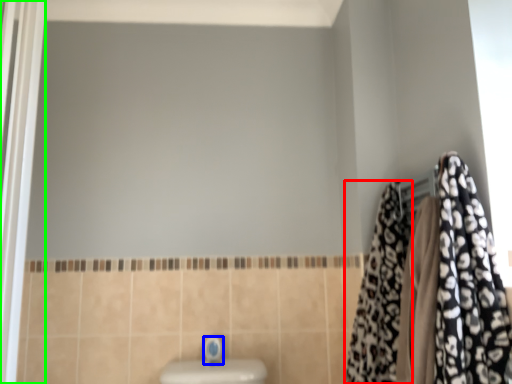
Question: Based on their relative distances, which object is farther from cloth (highlighted by a red box)? Choose from faucet (highlighted by a blue box) and screen door (highlighted by a green box).

Choices:
 (A) faucet
 (B) screen door

Answer: (B)